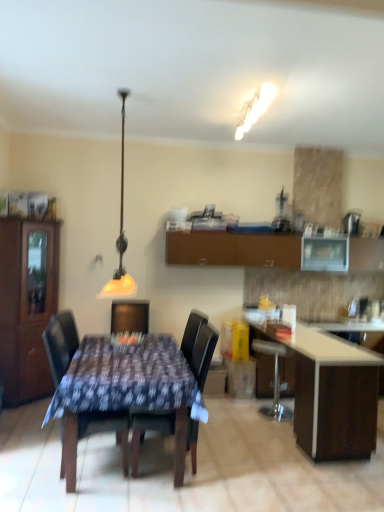
Question: Is brown matte cabinet at upper center, acting as the 1th cabinetry starting from the back, completely or partially inside brown wood cabinet at left, which ranks as the second cabinetry in right-to-left order?

Choices:
 (A) no
 (B) yes

Answer: (A)

Question: Does brown wood cabinet at left, marked as the 1th cabinetry in a left-to-right arrangement, come behind brown matte cabinet at upper center, the first cabinetry viewed from the right?

Choices:
 (A) no
 (B) yes

Answer: (A)

Question: From a real-world perspective, does brown wood cabinet at left, which ranks as the second cabinetry in right-to-left order, sit lower than brown matte cabinet at upper center, the second cabinetry viewed from the front?

Choices:
 (A) no
 (B) yes

Answer: (B)

Question: Can you confirm if brown wood cabinet at left, which ranks as the second cabinetry in right-to-left order, is taller than brown matte cabinet at upper center, the first cabinetry viewed from the right?

Choices:
 (A) yes
 (B) no

Answer: (A)

Question: Is brown wood cabinet at left, which ranks as the second cabinetry in right-to-left order, aimed at brown matte cabinet at upper center, acting as the 1th cabinetry starting from the back?

Choices:
 (A) no
 (B) yes

Answer: (A)

Question: From their relative heights in the image, would you say dark brown leather chair at center, the 1th chair positioned from the right, is taller or shorter than wooden table at center?

Choices:
 (A) short
 (B) tall

Answer: (B)

Question: Is point (211, 349) closer or farther from the camera than point (127, 408)?

Choices:
 (A) closer
 (B) farther

Answer: (B)

Question: From the image's perspective, is dark brown leather chair at center, arranged as the second chair when viewed from the left, located above or below wooden table at center?

Choices:
 (A) below
 (B) above

Answer: (B)

Question: Is dark brown leather chair at center, the 1th chair positioned from the right, inside or outside of wooden table at center?

Choices:
 (A) outside
 (B) inside

Answer: (B)

Question: From a real-world perspective, relative to dark brown leather chair at center, the 1th chair positioned from the right, is white glossy table at lower right vertically above or below?

Choices:
 (A) below
 (B) above

Answer: (A)

Question: Based on their sizes in the image, would you say white glossy table at lower right is bigger or smaller than dark brown leather chair at center, arranged as the second chair when viewed from the left?

Choices:
 (A) big
 (B) small

Answer: (A)

Question: Looking at their shapes, would you say white glossy table at lower right is wider or thinner than dark brown leather chair at center, the 1th chair positioned from the right?

Choices:
 (A) wide
 (B) thin

Answer: (A)

Question: Is white glossy table at lower right in front of or behind dark brown leather chair at center, the 1th chair positioned from the right, in the image?

Choices:
 (A) behind
 (B) front

Answer: (A)

Question: In terms of height, does wooden table at center look taller or shorter compared to dark brown leather chair at center, the 1th chair positioned from the right?

Choices:
 (A) tall
 (B) short

Answer: (B)

Question: Is wooden table at center spatially inside dark brown leather chair at center, the 1th chair positioned from the right, or outside of it?

Choices:
 (A) inside
 (B) outside

Answer: (B)